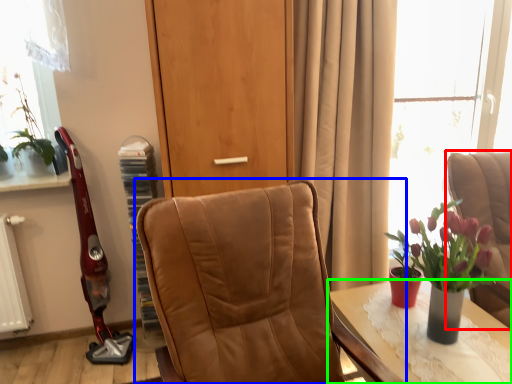
Question: Which is nearer to the chair (highlighted by a red box)? chair (highlighted by a blue box) or table (highlighted by a green box).

Choices:
 (A) chair
 (B) table

Answer: (B)